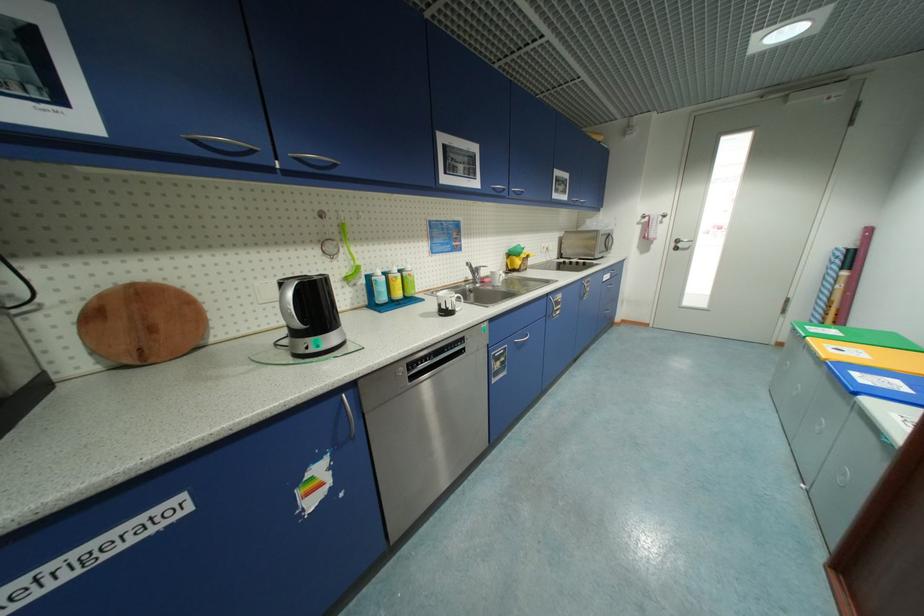
What do you see at coordinates (608, 241) in the screenshot? I see `the microwave button` at bounding box center [608, 241].